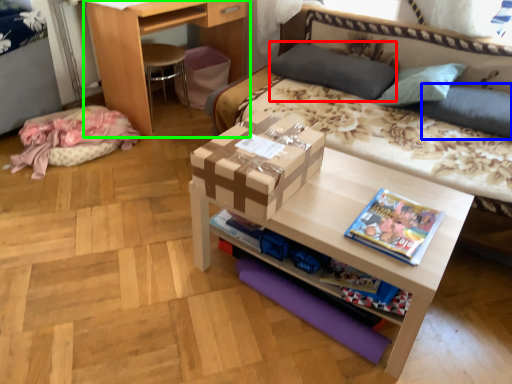
Question: Based on their relative distances, which object is farther from pillow (highlighted by a red box)? Choose from pillow (highlighted by a blue box) and desk (highlighted by a green box).

Choices:
 (A) pillow
 (B) desk

Answer: (B)